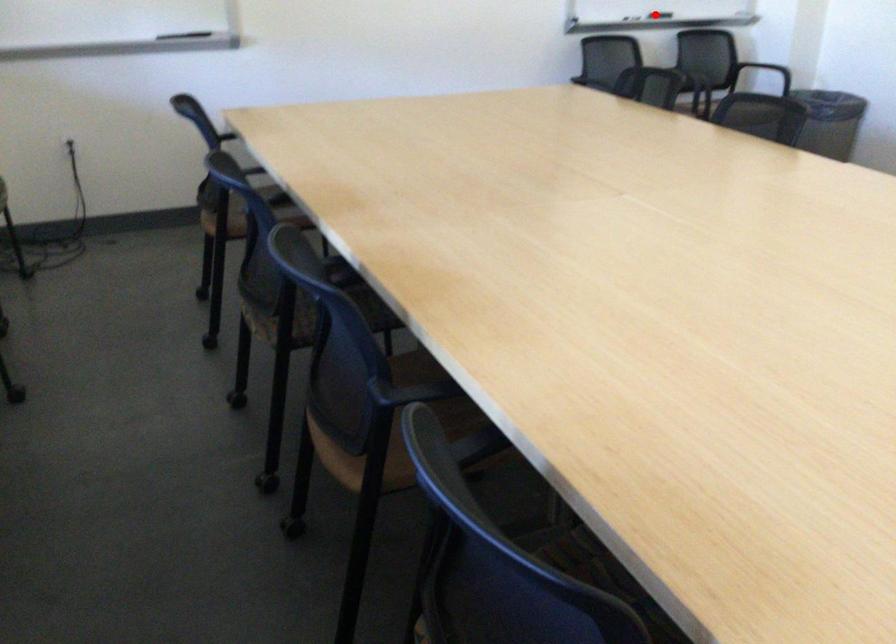
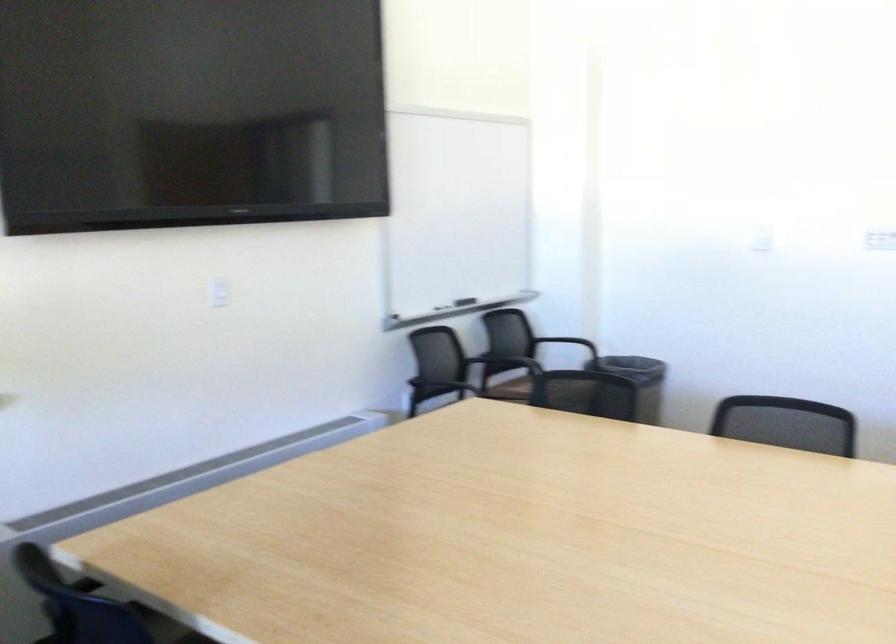
Question: I am providing you with two images of the same scene from different viewpoints. A red point is marked on the first image. Can you still see the location of the red point in image 2?

Choices:
 (A) Yes
 (B) No

Answer: (B)